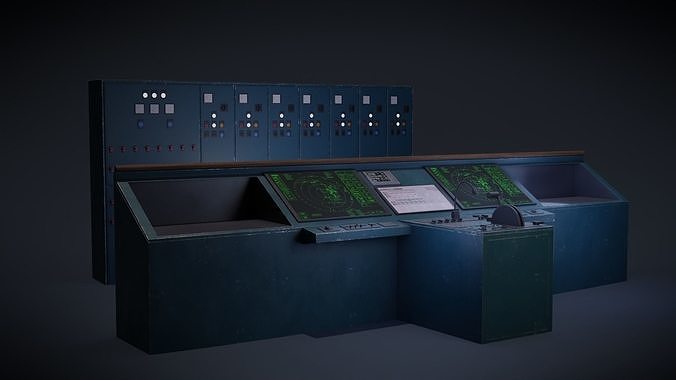
In order to click on panel in this screenshot , I will do `click(151, 135)`, `click(218, 123)`, `click(247, 134)`, `click(287, 124)`, `click(320, 125)`, `click(339, 109)`, `click(374, 124)`, `click(399, 123)`.